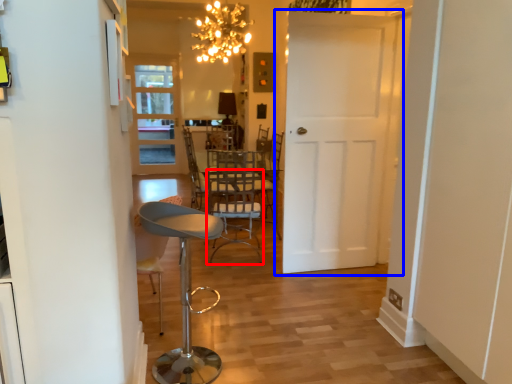
Question: Which object appears farthest to the camera in this image, armchair (highlighted by a red box) or door (highlighted by a blue box)?

Choices:
 (A) armchair
 (B) door

Answer: (A)